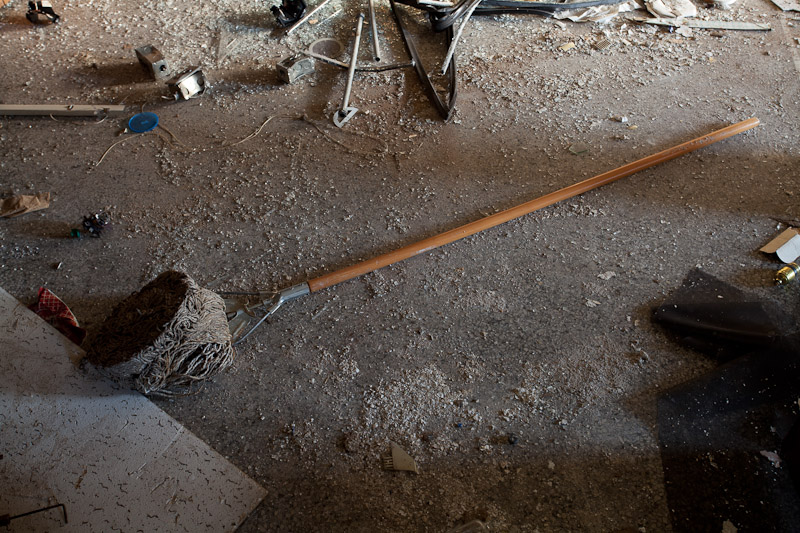
Identify the location of mop end. coord(182,334).